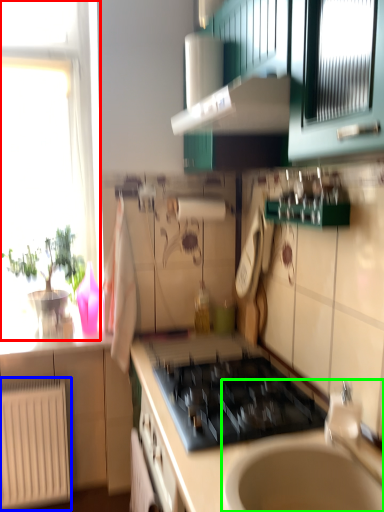
Question: Considering the real-world distances, which object is farthest from window (highlighted by a red box)? radiator (highlighted by a blue box) or sink (highlighted by a green box)?

Choices:
 (A) radiator
 (B) sink

Answer: (B)